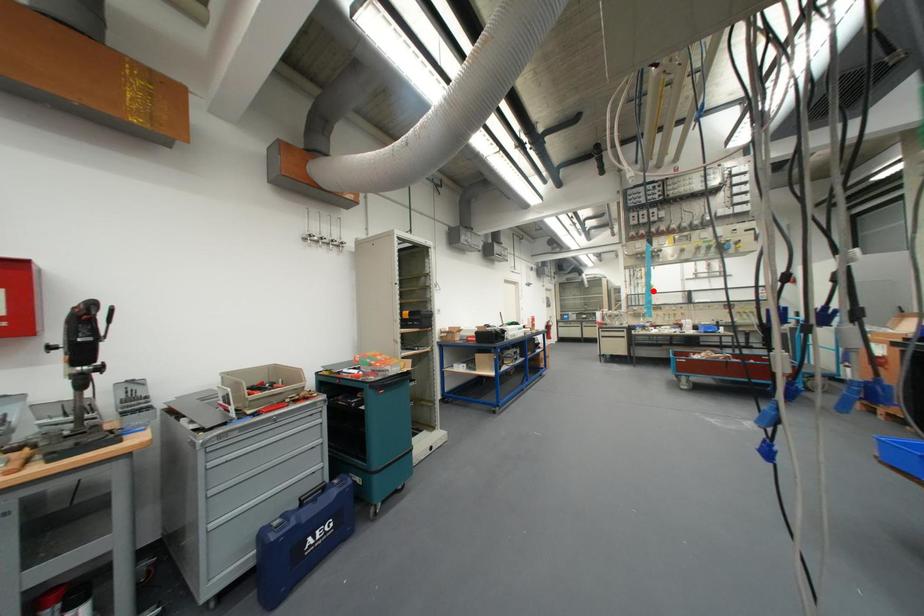
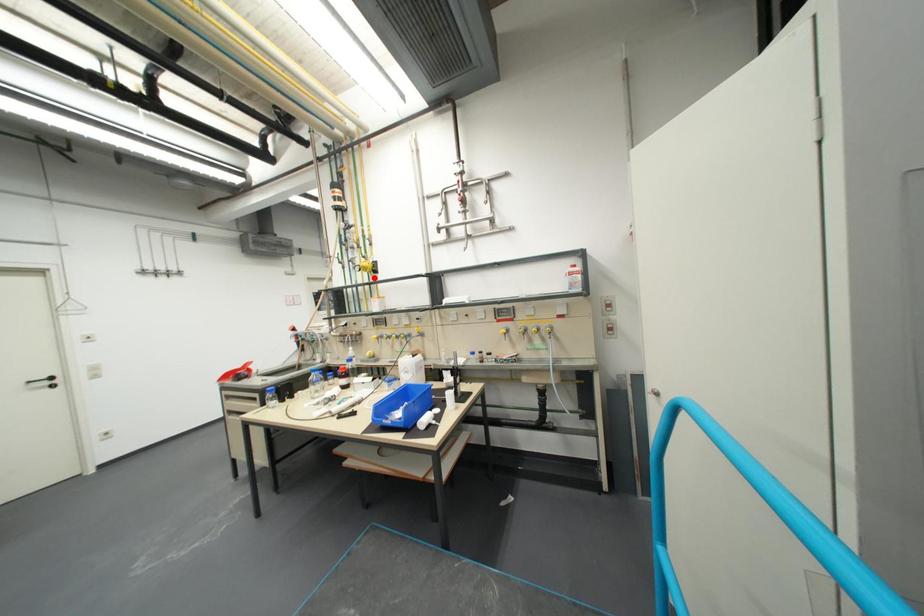
I am providing you with two images of the same scene from different viewpoints. A red point is marked on the first image and another point is marked on the second image. Is the red point in image1 aligned with the point shown in image2?

Yes